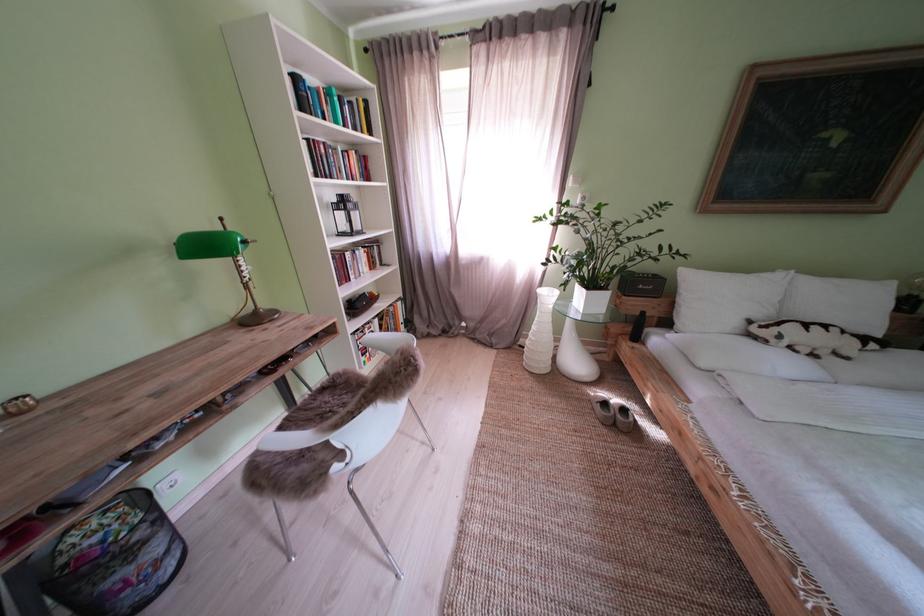
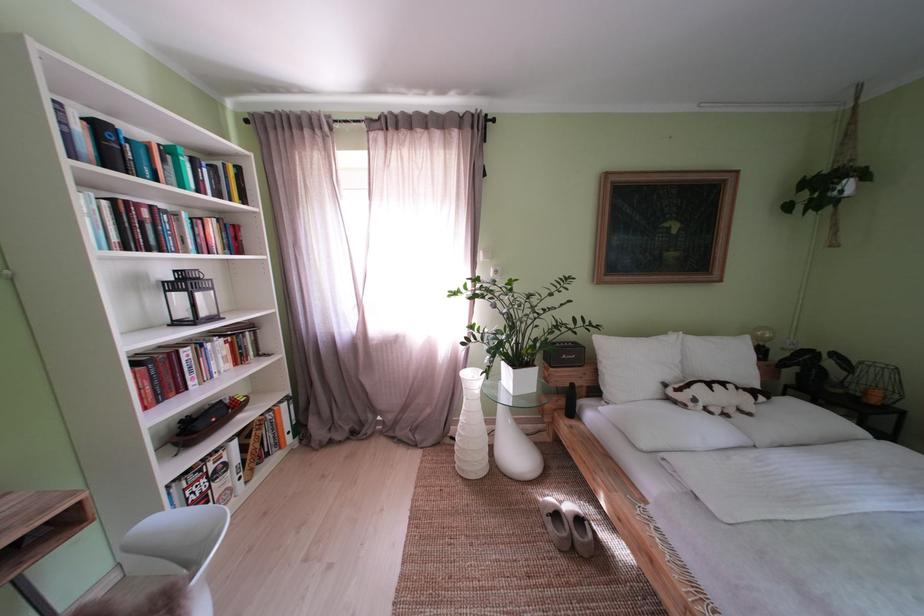
Locate, in the second image, the point that corresponds to (x=307, y=84) in the first image.

(111, 132)